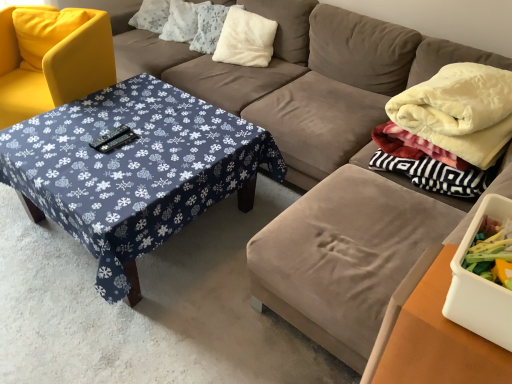
Question: Considering the positions of white fluffy pillow at upper center, the third pillow when ordered from right to left, and wooden table at lower right in the image, is white fluffy pillow at upper center, the third pillow when ordered from right to left, wider or thinner than wooden table at lower right?

Choices:
 (A) wide
 (B) thin

Answer: (A)

Question: Considering their positions, is white fluffy pillow at upper center, the third pillow when ordered from right to left, located in front of or behind wooden table at lower right?

Choices:
 (A) front
 (B) behind

Answer: (B)

Question: Considering the real-world distances, which object is farthest from the white fluffy pillow at upper center, which is counted as the first pillow, starting from the right?

Choices:
 (A) wooden table at lower right
 (B) velvet white blanket at right
 (C) yellow fabric chair at left
 (D) blue fabric-covered table at center-left
 (E) white fluffy pillow at upper center, which is the 1th pillow from left to right

Answer: (A)

Question: Which is farther from the velvet white blanket at right?

Choices:
 (A) blue fabric-covered table at center-left
 (B) white fluffy pillow at center, arranged as the second pillow when viewed from the right
 (C) wooden table at lower right
 (D) yellow fabric chair at left
 (E) white fluffy pillow at upper center, the third pillow when ordered from right to left

Answer: (D)